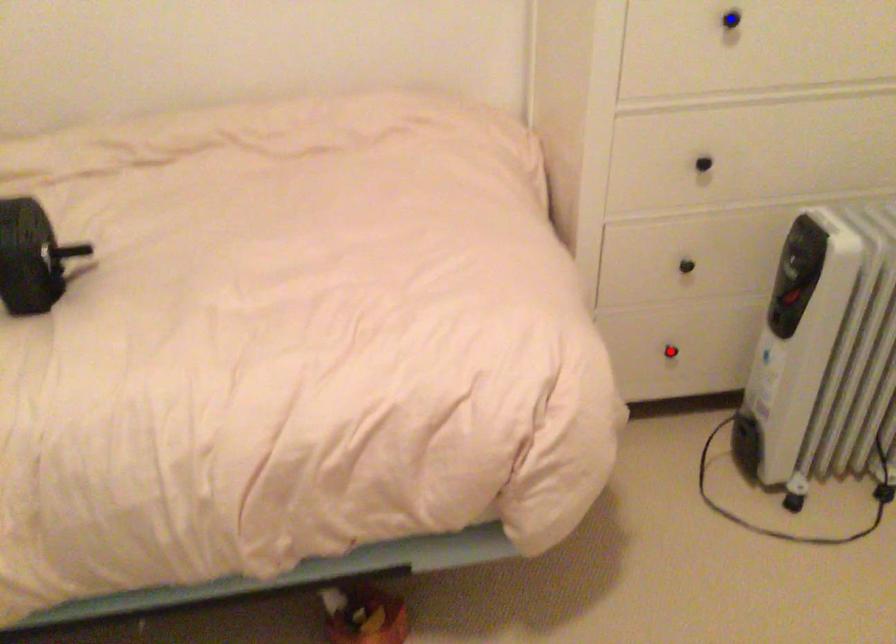
Question: Two points are marked on the image. Which point is closer to the camera?

Choices:
 (A) Blue point is closer.
 (B) Red point is closer.

Answer: (A)